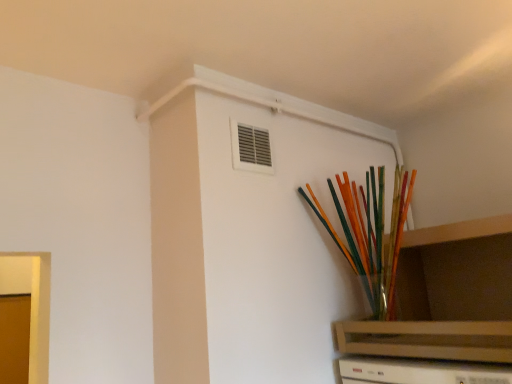
Measure the distance between clear glass vase at upper right and camera.

clear glass vase at upper right and camera are 4.40 feet apart.

Describe the element at coordinates (446, 297) in the screenshot. I see `clear glass vase at upper right` at that location.

I want to click on clear glass vase at upper right, so click(x=446, y=297).

Locate an element on the screen. This screenshot has width=512, height=384. translucent glass vase at upper right is located at coordinates [370, 234].

What do you see at coordinates (370, 234) in the screenshot? The width and height of the screenshot is (512, 384). I see `translucent glass vase at upper right` at bounding box center [370, 234].

Find the location of a particular element. The image size is (512, 384). clear glass vase at upper right is located at coordinates (446, 297).

Consider the image. Is clear glass vase at upper right to the left or to the right of translucent glass vase at upper right in the image?

Clearly, clear glass vase at upper right is on the right of translucent glass vase at upper right in the image.

Is clear glass vase at upper right further to camera compared to translucent glass vase at upper right?

No, the depth of clear glass vase at upper right is less than that of translucent glass vase at upper right.

Is point (434, 248) positioned behind point (322, 212)?

That is True.

From the image's perspective, is clear glass vase at upper right located above or below translucent glass vase at upper right?

Based on their image positions, clear glass vase at upper right is located beneath translucent glass vase at upper right.

From a real-world perspective, who is located lower, clear glass vase at upper right or translucent glass vase at upper right?

From a 3D spatial view, clear glass vase at upper right is below.

Considering the sizes of clear glass vase at upper right and translucent glass vase at upper right in the image, is clear glass vase at upper right wider or thinner than translucent glass vase at upper right?

In the image, clear glass vase at upper right appears to be wider than translucent glass vase at upper right.

In the scene shown: Considering the sizes of clear glass vase at upper right and translucent glass vase at upper right in the image, is clear glass vase at upper right taller or shorter than translucent glass vase at upper right?

In the image, clear glass vase at upper right appears to be shorter than translucent glass vase at upper right.

Considering the sizes of objects clear glass vase at upper right and translucent glass vase at upper right in the image provided, who is bigger, clear glass vase at upper right or translucent glass vase at upper right?

With larger size is clear glass vase at upper right.

Is clear glass vase at upper right positioned beyond the bounds of translucent glass vase at upper right?

No, clear glass vase at upper right is not outside of translucent glass vase at upper right.

Based on the photo, is clear glass vase at upper right placed right next to translucent glass vase at upper right?

They are not placed beside each other.

Consider the image. Is clear glass vase at upper right oriented towards translucent glass vase at upper right?

Yes.

Image resolution: width=512 pixels, height=384 pixels. Find the location of `shelf lying below the translucent glass vase at upper right (from the image's perspective)`. shelf lying below the translucent glass vase at upper right (from the image's perspective) is located at coordinates (446, 297).

Considering the positions of objects translucent glass vase at upper right and clear glass vase at upper right in the image provided, who is more to the left, translucent glass vase at upper right or clear glass vase at upper right?

Positioned to the left is translucent glass vase at upper right.

Is translucent glass vase at upper right positioned in front of clear glass vase at upper right?

No, it is behind clear glass vase at upper right.

Which is more distant, (407, 202) or (408, 350)?

The point (407, 202) is farther from the camera.

From the image's perspective, which one is positioned higher, translucent glass vase at upper right or clear glass vase at upper right?

translucent glass vase at upper right, from the image's perspective.

From a real-world perspective, does translucent glass vase at upper right sit lower than clear glass vase at upper right?

No, from a real-world perspective, translucent glass vase at upper right is not beneath clear glass vase at upper right.

Is translucent glass vase at upper right thinner than clear glass vase at upper right?

Yes, translucent glass vase at upper right is thinner than clear glass vase at upper right.

Which of these two, translucent glass vase at upper right or clear glass vase at upper right, stands shorter?

clear glass vase at upper right is shorter.

Considering the relative sizes of translucent glass vase at upper right and clear glass vase at upper right in the image provided, is translucent glass vase at upper right smaller than clear glass vase at upper right?

Correct, translucent glass vase at upper right occupies less space than clear glass vase at upper right.

Which is correct: translucent glass vase at upper right is inside clear glass vase at upper right, or outside of it?

translucent glass vase at upper right fits inside clear glass vase at upper right.

Are translucent glass vase at upper right and clear glass vase at upper right beside each other?

They are not placed beside each other.

Is translucent glass vase at upper right positioned with its back to clear glass vase at upper right?

Yes, clear glass vase at upper right is at the back of translucent glass vase at upper right.

What's the angular difference between translucent glass vase at upper right and clear glass vase at upper right's facing directions?

1.28 degrees.

You are a GUI agent. You are given a task and a screenshot of the screen. Output one action in this format:
    pyautogui.click(x=<x>, y=<y>)
    Task: Click on the paint brush that is on the left side of clear glass vase at upper right
    
    Given the screenshot: What is the action you would take?
    pyautogui.click(x=370, y=234)

Where is `paint brush on the left of the clear glass vase at upper right`? This screenshot has height=384, width=512. paint brush on the left of the clear glass vase at upper right is located at coordinates (370, 234).

Locate an element on the screen. paint brush located above the clear glass vase at upper right (from a real-world perspective) is located at coordinates (370, 234).